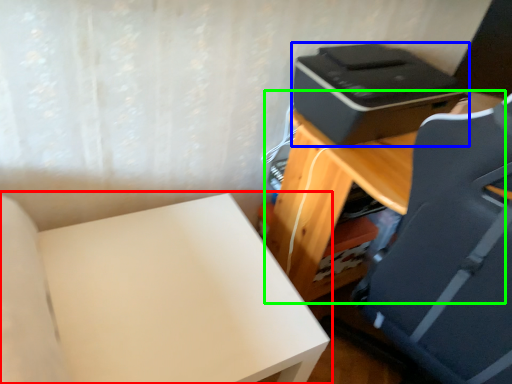
Question: Estimate the real-world distances between objects in this image. Which object is farther from furniture (highlighted by a red box), printer (highlighted by a blue box) or table (highlighted by a green box)?

Choices:
 (A) printer
 (B) table

Answer: (A)